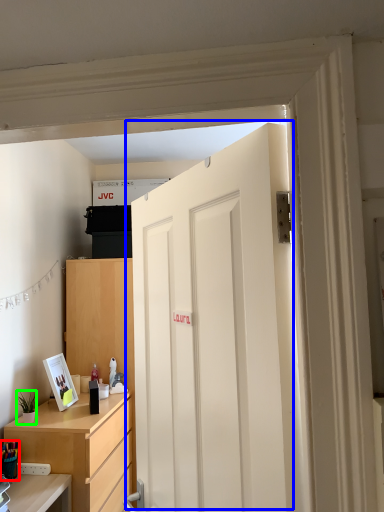
Question: Estimate the real-world distances between objects in this image. Which object is farther from stationery (highlighted by a red box), door (highlighted by a blue box) or houseplant (highlighted by a green box)?

Choices:
 (A) door
 (B) houseplant

Answer: (A)